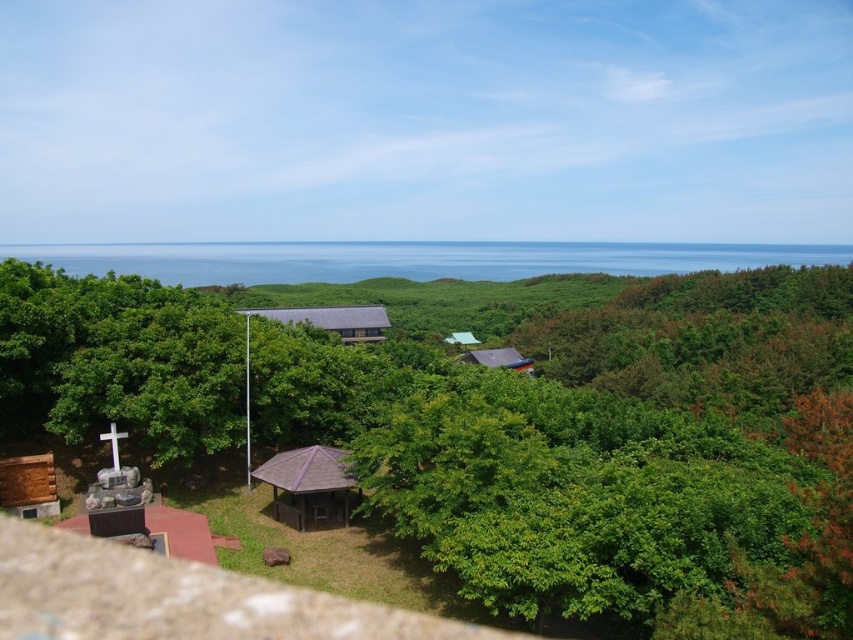
Question: Does brown wooden hut at center have a smaller size compared to wooden hut at center?

Choices:
 (A) yes
 (B) no

Answer: (A)

Question: Is brown wooden hut at center thinner than purple corrugated metal hut at center?

Choices:
 (A) no
 (B) yes

Answer: (B)

Question: Which point appears closest to the camera in this image?

Choices:
 (A) (386, 321)
 (B) (463, 339)
 (C) (242, 436)

Answer: (C)

Question: Based on their relative distances, which object is farther from the brown wooden hut at center?

Choices:
 (A) wooden hut at center
 (B) green matte hut at center
 (C) green leafy tree at center
 (D) purple corrugated metal hut at center

Answer: (B)

Question: Which point appears farthest from the camera in this image?

Choices:
 (A) (752, 403)
 (B) (291, 472)
 (C) (454, 336)

Answer: (C)

Question: Does green leafy tree at center lie behind purple corrugated metal hut at center?

Choices:
 (A) no
 (B) yes

Answer: (A)